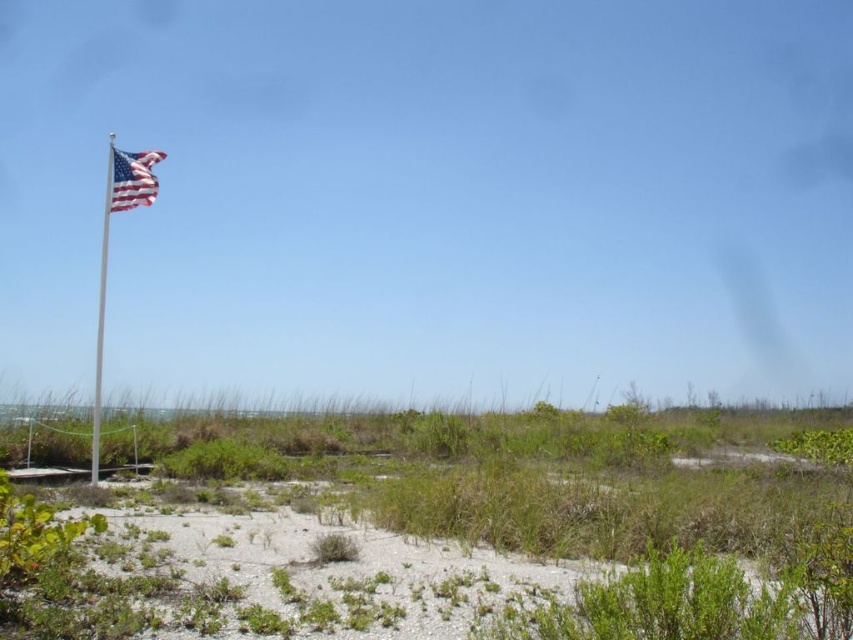
You are standing at the edge of the sandy area and want to walk towards the white metallic flag pole at left. Which direction should you head to avoid the green grassy sand at center?

To avoid the green grassy sand at center, you should head directly towards the white metallic flag pole at left since it is positioned to the left of the grassy sand area.

You are a photographer wanting to capture the white metallic flag pole at left and the green grassy sand at center in your shot. Which object is closer to the camera based on their positions?

The green grassy sand at center is positioned under the white metallic flag pole at left, meaning the flag pole is closer to the camera than the sand.

You are standing at the point marked by the coordinates point (566,476), which is labeled as green grassy sand at center. Looking towards the American flag mounted on a tall white pole on the left, is the flagpole to your left or right side?

The American flag mounted on a tall white pole is positioned towards the left side of the frame. Since you are at the point labeled green grassy sand at center, the flagpole would be to your left side.